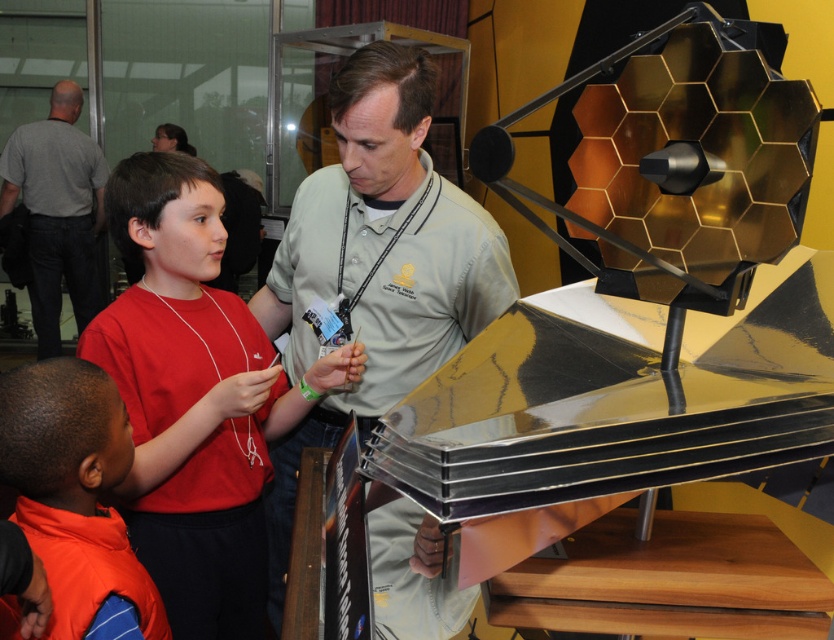
Who is taller, green matte shirt at center or gray shirt at upper left?

Standing taller between the two is gray shirt at upper left.

Can you confirm if green matte shirt at center is positioned below gray shirt at upper left?

Indeed, green matte shirt at center is positioned under gray shirt at upper left.

Does point (377, 205) come in front of point (59, 148)?

Yes, point (377, 205) is closer to viewer.

The width and height of the screenshot is (834, 640). What are the coordinates of `green matte shirt at center` in the screenshot? It's located at (375, 264).

Can you confirm if matte red shirt at center is bigger than gray shirt at upper left?

No, matte red shirt at center is not bigger than gray shirt at upper left.

Measure the distance between point (159,257) and camera.

Point (159,257) and camera are 4.90 feet apart.

What do you see at coordinates (194, 397) in the screenshot? The width and height of the screenshot is (834, 640). I see `matte red shirt at center` at bounding box center [194, 397].

Where is `matte red shirt at center`? matte red shirt at center is located at coordinates click(194, 397).

Which is more to the left, green matte shirt at center or matte red shirt at center?

matte red shirt at center

The width and height of the screenshot is (834, 640). What do you see at coordinates (375, 264) in the screenshot?
I see `green matte shirt at center` at bounding box center [375, 264].

Locate an element on the screen. The height and width of the screenshot is (640, 834). green matte shirt at center is located at coordinates (375, 264).

Locate an element on the screen. This screenshot has width=834, height=640. green matte shirt at center is located at coordinates (375, 264).